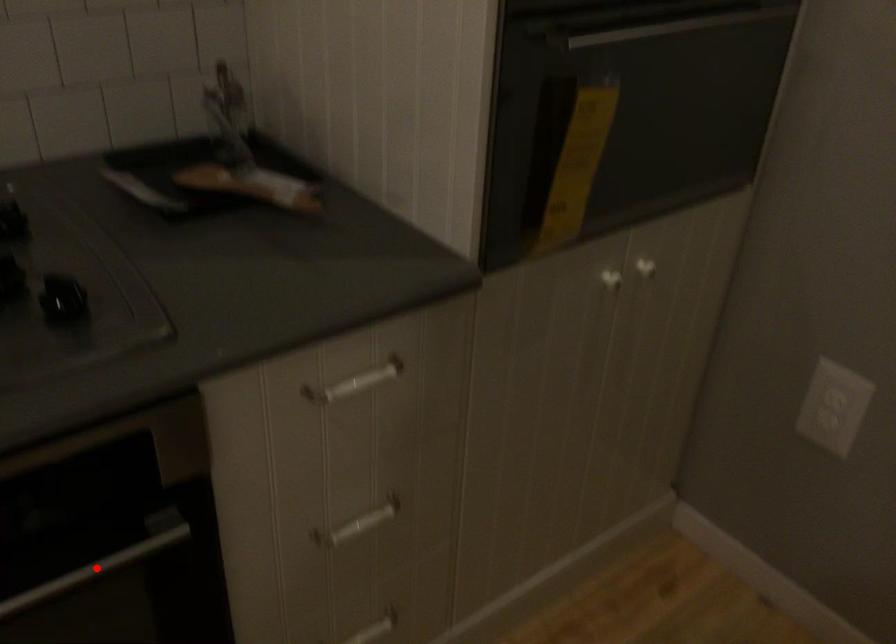
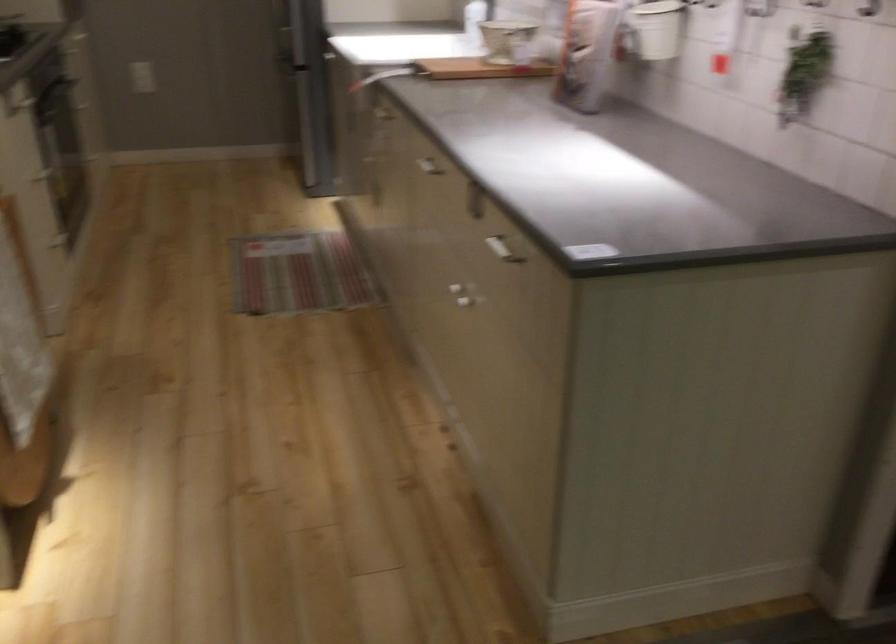
Question: I am providing you with two images of the same scene from different viewpoints. A red point is marked on the first image. Is the red point's position out of view in image 2?

Choices:
 (A) Yes
 (B) No

Answer: (A)